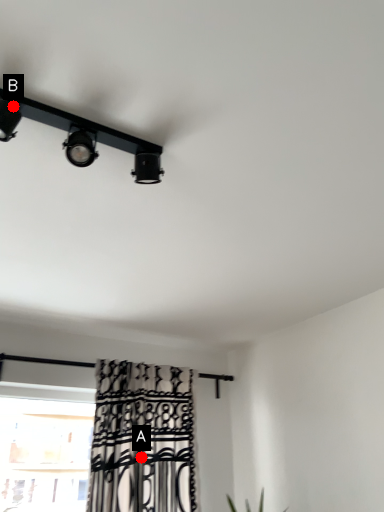
Question: Two points are circled on the image, labeled by A and B beside each circle. Which point is farther from the camera taking this photo?

Choices:
 (A) A is further
 (B) B is further

Answer: (A)